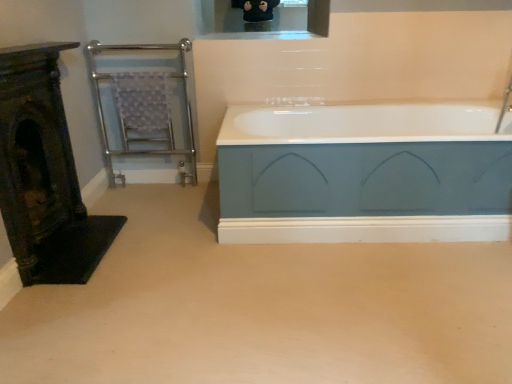
Find the location of `free space between dark green ornate fireplace at left and teal matte bathtub at center`. free space between dark green ornate fireplace at left and teal matte bathtub at center is located at coordinates (212, 236).